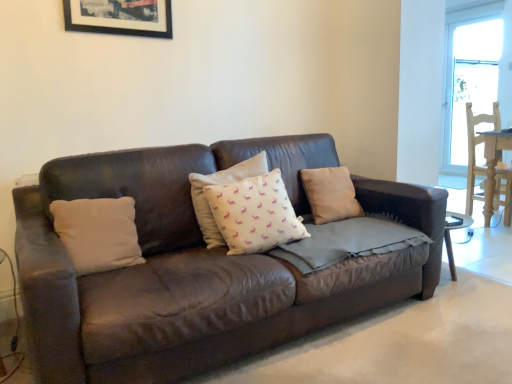
Question: Can you confirm if black matte picture frame at upper center is thinner than white cotton cushion at center, which ranks as the 2th pillow in left-to-right order?

Choices:
 (A) yes
 (B) no

Answer: (A)

Question: From a real-world perspective, is black matte picture frame at upper center located higher than white cotton cushion at center, which ranks as the 2th pillow in left-to-right order?

Choices:
 (A) yes
 (B) no

Answer: (A)

Question: Is black matte picture frame at upper center further to camera compared to white cotton cushion at center, which ranks as the 2th pillow in left-to-right order?

Choices:
 (A) yes
 (B) no

Answer: (A)

Question: From a real-world perspective, does black matte picture frame at upper center sit lower than white cotton cushion at center, which ranks as the 2th pillow in left-to-right order?

Choices:
 (A) yes
 (B) no

Answer: (B)

Question: Does black matte picture frame at upper center have a larger size compared to white cotton cushion at center, the third pillow viewed from the right?

Choices:
 (A) yes
 (B) no

Answer: (B)

Question: Considering the positions of point (233, 225) and point (215, 236), is point (233, 225) closer or farther from the camera than point (215, 236)?

Choices:
 (A) closer
 (B) farther

Answer: (A)

Question: Is white fabric pillow with pink patterns at center, which is the second pillow in right-to-left order, inside or outside of white cotton cushion at center, the third pillow viewed from the right?

Choices:
 (A) inside
 (B) outside

Answer: (B)

Question: From a real-world perspective, relative to white cotton cushion at center, the third pillow viewed from the right, is white fabric pillow with pink patterns at center, which is the third pillow from left to right, vertically above or below?

Choices:
 (A) below
 (B) above

Answer: (A)

Question: From their relative heights in the image, would you say white fabric pillow with pink patterns at center, which is the second pillow in right-to-left order, is taller or shorter than white cotton cushion at center, which ranks as the 2th pillow in left-to-right order?

Choices:
 (A) short
 (B) tall

Answer: (A)

Question: From the image's perspective, is white cotton pillow at left, placed as the 4th pillow when sorted from right to left, positioned above or below white fabric pillow with pink patterns at center, which is the third pillow from left to right?

Choices:
 (A) above
 (B) below

Answer: (B)

Question: From a real-world perspective, is white cotton pillow at left, which ranks as the first pillow in left-to-right order, positioned above or below white fabric pillow with pink patterns at center, which is the second pillow in right-to-left order?

Choices:
 (A) above
 (B) below

Answer: (B)

Question: From their relative heights in the image, would you say white cotton pillow at left, which ranks as the first pillow in left-to-right order, is taller or shorter than white fabric pillow with pink patterns at center, which is the second pillow in right-to-left order?

Choices:
 (A) short
 (B) tall

Answer: (A)

Question: Is point (106, 249) closer or farther from the camera than point (284, 225)?

Choices:
 (A) farther
 (B) closer

Answer: (B)

Question: From a real-world perspective, is black matte picture frame at upper center above or below beige fabric pillow at center, positioned as the 4th pillow in left-to-right order?

Choices:
 (A) above
 (B) below

Answer: (A)

Question: Is point (92, 6) positioned closer to the camera than point (320, 220)?

Choices:
 (A) closer
 (B) farther

Answer: (A)